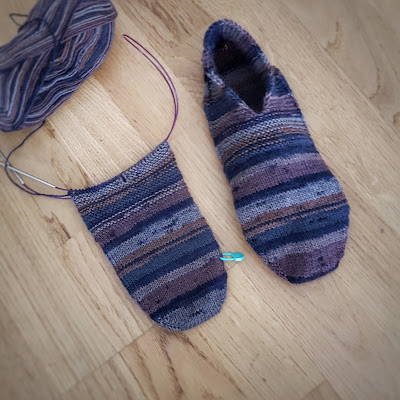
The image size is (400, 400). Find the location of `blonde wood in lower (my) right corner`. blonde wood in lower (my) right corner is located at coordinates (360, 378).